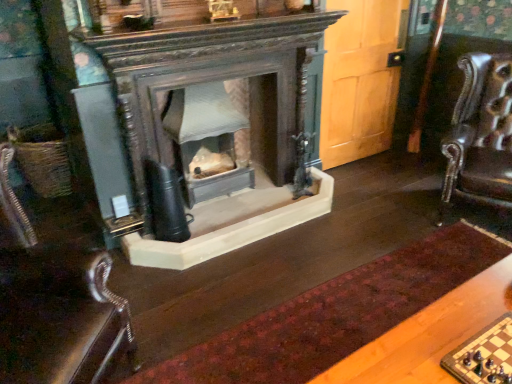
Question: Is leather at left smaller than velvet burgundy rug at center?

Choices:
 (A) yes
 (B) no

Answer: (B)

Question: Does leather at left lie in front of velvet burgundy rug at center?

Choices:
 (A) no
 (B) yes

Answer: (B)

Question: From the image's perspective, is leather at left beneath velvet burgundy rug at center?

Choices:
 (A) yes
 (B) no

Answer: (B)

Question: Is leather at left shorter than velvet burgundy rug at center?

Choices:
 (A) no
 (B) yes

Answer: (A)

Question: Does leather at left appear on the left side of velvet burgundy rug at center?

Choices:
 (A) yes
 (B) no

Answer: (A)

Question: Visually, is wooden chessboard at lower right positioned to the left or to the right of leather at left?

Choices:
 (A) left
 (B) right

Answer: (B)

Question: Is wooden chessboard at lower right taller or shorter than leather at left?

Choices:
 (A) tall
 (B) short

Answer: (B)

Question: Looking at the image, does wooden chessboard at lower right seem bigger or smaller compared to leather at left?

Choices:
 (A) big
 (B) small

Answer: (B)

Question: From a real-world perspective, is wooden chessboard at lower right physically located above or below leather at left?

Choices:
 (A) above
 (B) below

Answer: (A)

Question: From a real-world perspective, is leather swivel chair at right physically located above or below matte glass fireplace at center?

Choices:
 (A) above
 (B) below

Answer: (A)

Question: From the image's perspective, is leather swivel chair at right above or below matte glass fireplace at center?

Choices:
 (A) below
 (B) above

Answer: (A)

Question: Considering the positions of leather swivel chair at right and matte glass fireplace at center in the image, is leather swivel chair at right taller or shorter than matte glass fireplace at center?

Choices:
 (A) short
 (B) tall

Answer: (B)

Question: Does point (508, 153) appear closer or farther from the camera than point (167, 97)?

Choices:
 (A) farther
 (B) closer

Answer: (B)

Question: Looking at the image, does leather at left seem bigger or smaller compared to wooden chessboard at lower right?

Choices:
 (A) small
 (B) big

Answer: (B)

Question: Is leather at left taller or shorter than wooden chessboard at lower right?

Choices:
 (A) tall
 (B) short

Answer: (A)